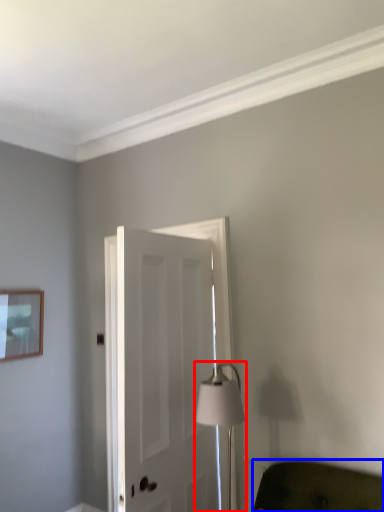
Question: Which point is closer to the camera, table lamp (highlighted by a red box) or furniture (highlighted by a blue box)?

Choices:
 (A) table lamp
 (B) furniture

Answer: (B)